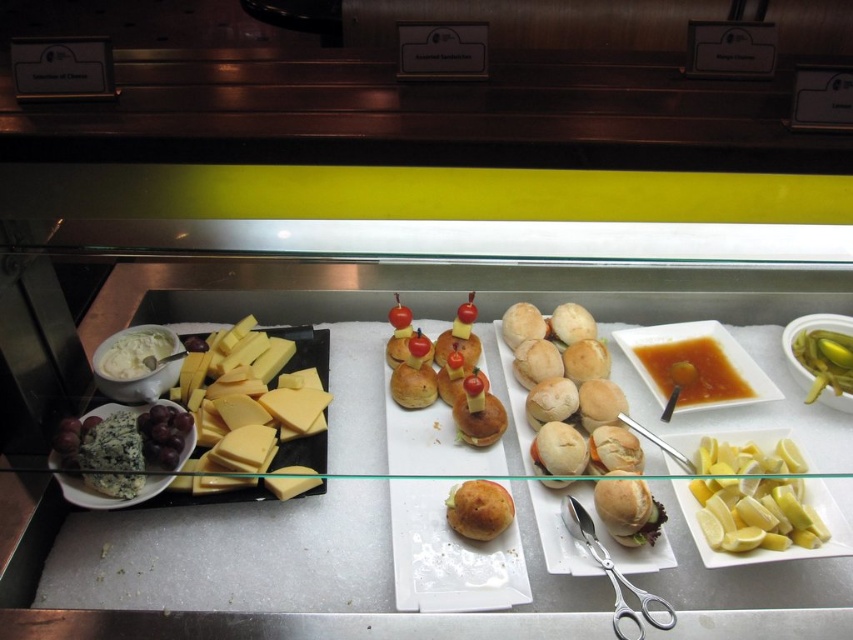
You are a food server who needs to cut the yellow hard cheese at left for a customer. Can you use the silver metallic scissors at lower right to do this task? Explain your reasoning based on their sizes.

The yellow hard cheese at left is much taller than the silver metallic scissors at lower right. Since the cheese is taller, the scissors may not be able to fully close around it, making it difficult to cut effectively.

You are a customer at a buffet and want to grab a lemon slice. The lemon slices are located at point [753,499]. If you are currently standing at the center of the image, which direction should you move to reach the lemon slices?

The yellow translucent lemon slices at lower right is located at point [753,499], so you should move towards the lower right direction to reach them.